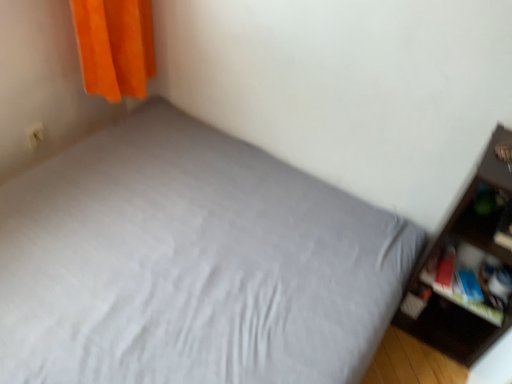
Question: Is matte dark brown shelf at right not close to matte plastic cabinet at right?

Choices:
 (A) no
 (B) yes

Answer: (A)

Question: Does matte dark brown shelf at right turn towards matte plastic cabinet at right?

Choices:
 (A) no
 (B) yes

Answer: (B)

Question: Can you confirm if matte dark brown shelf at right is shorter than matte plastic cabinet at right?

Choices:
 (A) no
 (B) yes

Answer: (A)

Question: From the image's perspective, is matte dark brown shelf at right on top of matte plastic cabinet at right?

Choices:
 (A) yes
 (B) no

Answer: (A)

Question: Is matte dark brown shelf at right positioned before matte plastic cabinet at right?

Choices:
 (A) yes
 (B) no

Answer: (A)

Question: Is matte dark brown shelf at right facing away from matte plastic cabinet at right?

Choices:
 (A) yes
 (B) no

Answer: (A)

Question: From a real-world perspective, is matte plastic cabinet at right physically above gray fabric bed at center?

Choices:
 (A) yes
 (B) no

Answer: (A)

Question: From the image's perspective, is matte plastic cabinet at right on top of gray fabric bed at center?

Choices:
 (A) yes
 (B) no

Answer: (B)

Question: Can you confirm if matte plastic cabinet at right is positioned to the right of gray fabric bed at center?

Choices:
 (A) yes
 (B) no

Answer: (A)

Question: Could you tell me if matte plastic cabinet at right is turned towards gray fabric bed at center?

Choices:
 (A) no
 (B) yes

Answer: (A)

Question: Is gray fabric bed at center located within matte plastic cabinet at right?

Choices:
 (A) no
 (B) yes

Answer: (A)

Question: Does matte plastic cabinet at right have a greater height compared to gray fabric bed at center?

Choices:
 (A) no
 (B) yes

Answer: (A)

Question: Is gray fabric bed at center located outside matte plastic cabinet at right?

Choices:
 (A) no
 (B) yes

Answer: (B)